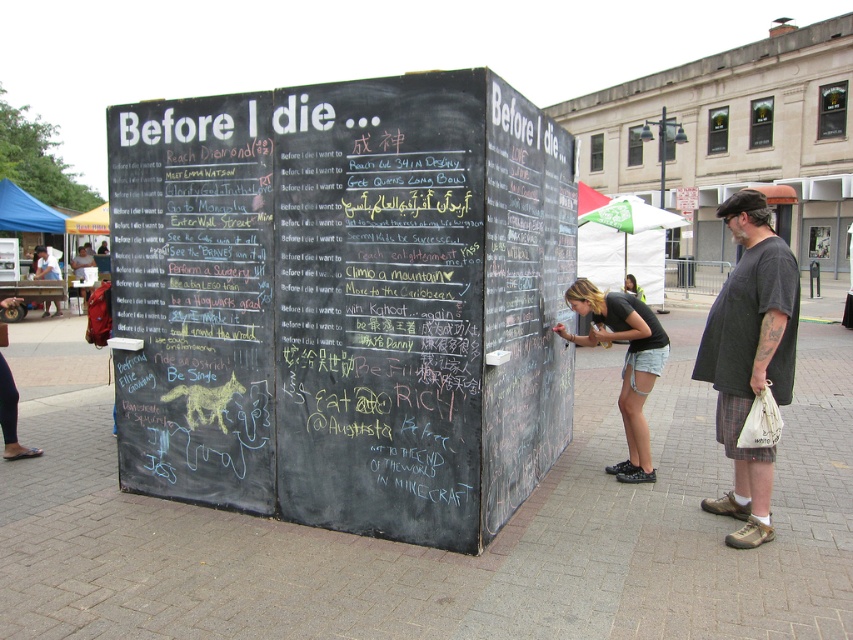
Question: Observing the image, what is the correct spatial positioning of black chalkboard at left in reference to green fabric umbrella at upper center?

Choices:
 (A) left
 (B) right

Answer: (A)

Question: Observing the image, what is the correct spatial positioning of green fabric umbrella at upper center in reference to light brown hair at center?

Choices:
 (A) below
 (B) above

Answer: (B)

Question: Considering the real-world distances, which object is closest to the black chalkboard at left?

Choices:
 (A) green fabric umbrella at upper center
 (B) dark gray t-shirt at right

Answer: (B)

Question: Estimate the real-world distances between objects in this image. Which object is farther from the black t-shirt at lower right?

Choices:
 (A) green fabric umbrella at upper center
 (B) light brown hair at center
 (C) black chalkboard at center

Answer: (B)

Question: Which of these objects is positioned farthest from the green fabric umbrella at upper center?

Choices:
 (A) black t-shirt at lower right
 (B) dark gray t-shirt at right
 (C) black chalkboard at left
 (D) black chalkboard at center

Answer: (B)

Question: Is black chalkboard at left to the left of dark gray t-shirt at right from the viewer's perspective?

Choices:
 (A) no
 (B) yes

Answer: (B)